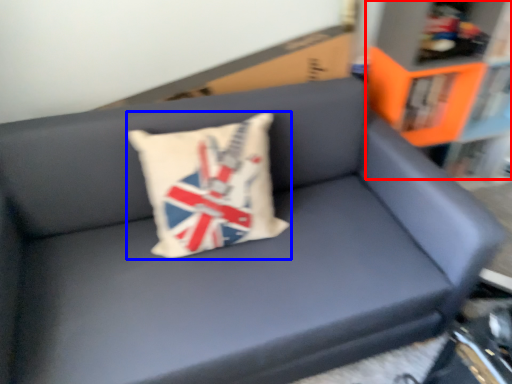
Question: Which object is further to the camera taking this photo, bookcase (highlighted by a red box) or pillow (highlighted by a blue box)?

Choices:
 (A) bookcase
 (B) pillow

Answer: (A)